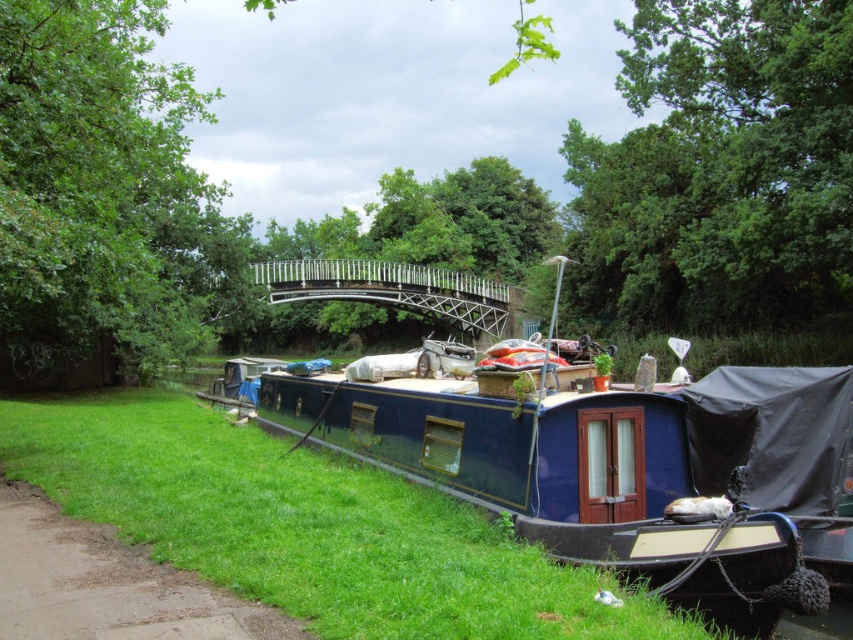
You are standing on the paved path next to the river and want to walk towards the narrowboat. There are two points marked on the ground ahead of you. The first point is at coordinate point(555,401) and the second point is at coordinate point(328,268). Which point should you step on first to reach the narrowboat more directly?

You should step on point(555,401) first because it is in front of point(328,268), meaning it is closer to the narrowboat.

You are a photographer planning to capture the blue glossy boat at center and the green grass at lower left in the same frame. Considering their sizes, which object should you position closer to the camera to ensure both are visible in the frame?

The blue glossy boat at center is larger than the green grass at lower left, so you should position the green grass at lower left closer to the camera to ensure both are visible in the frame.

You are standing on the riverside path and want to walk towards the metallic silver bridge at center. Which direction should you walk to avoid stepping on the green grass at lower left?

To reach the metallic silver bridge at center without stepping on the green grass at lower left, walk towards the bridge while staying on the paved path, which is parallel to the grassy bank. Since the green grass at lower left is in front of the bridge, moving along the path away from the grass towards the bridge will keep you on solid ground.